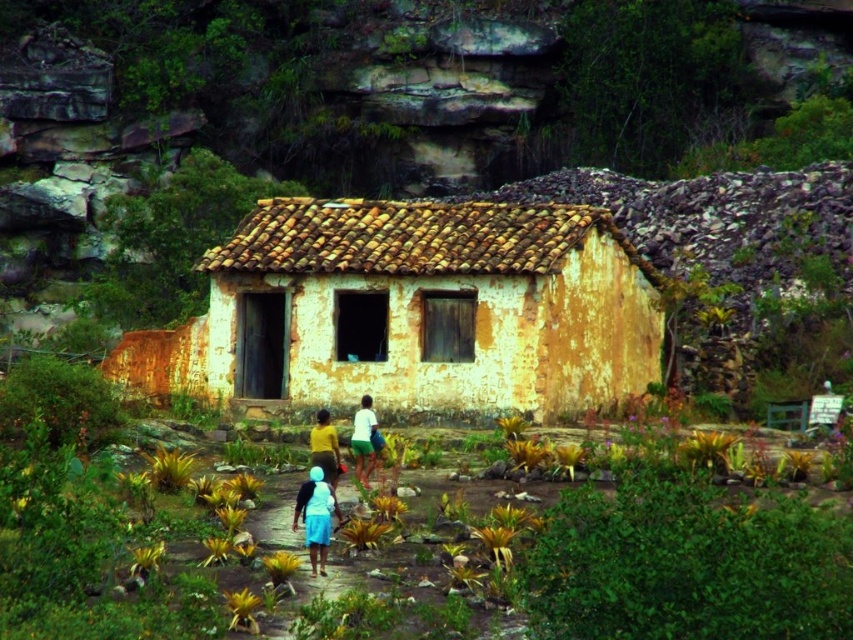
Looking at this image, between yellow matte shirt at center and white matte shirt at center, which one appears on the right side from the viewer's perspective?

From the viewer's perspective, white matte shirt at center appears more on the right side.

Does yellow matte shirt at center have a lesser height compared to white matte shirt at center?

Yes.

Is point (340, 461) in front of point (357, 461)?

Yes, point (340, 461) is in front of point (357, 461).

The image size is (853, 640). In order to click on yellow matte shirt at center in this screenshot , I will do `click(325, 448)`.

Who is higher up, yellowish weathered wood hut at center or white matte skirt at center?

yellowish weathered wood hut at center is above.

What do you see at coordinates (430, 307) in the screenshot? I see `yellowish weathered wood hut at center` at bounding box center [430, 307].

Identify the location of yellowish weathered wood hut at center. The image size is (853, 640). point(430,307).

Is white matte skirt at center behind white matte shirt at center?

No.

Find the location of a particular element. The height and width of the screenshot is (640, 853). white matte skirt at center is located at coordinates (316, 516).